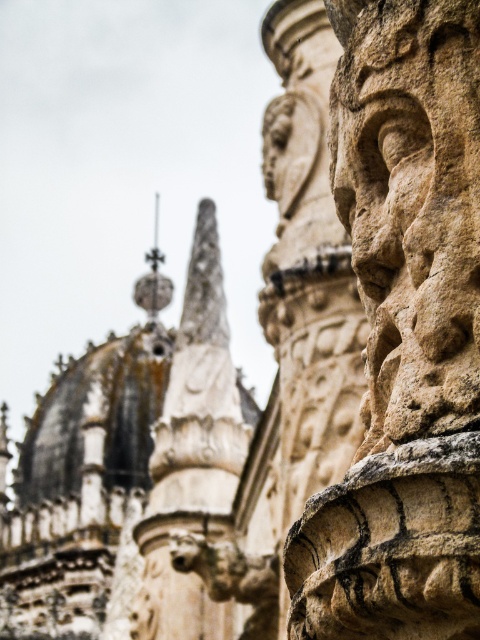
Is white stone spire at upper center smaller than polished silver spire at center?

No.

From the picture: Measure the distance between point (168, 502) and camera.

Point (168, 502) is 74.99 meters away from camera.

This screenshot has width=480, height=640. I want to click on white stone spire at upper center, so click(192, 456).

Which of these two, stone textured face at right or white stone spire at upper center, stands shorter?

Standing shorter between the two is stone textured face at right.

Does stone textured face at right appear over white stone spire at upper center?

Indeed, stone textured face at right is positioned over white stone spire at upper center.

The width and height of the screenshot is (480, 640). Find the location of `stone textured face at right`. stone textured face at right is located at coordinates (410, 205).

This screenshot has height=640, width=480. I want to click on stone textured face at right, so click(410, 205).

Consider the image. Does stone textured face at right have a lesser height compared to polished silver spire at center?

Indeed, stone textured face at right has a lesser height compared to polished silver spire at center.

Between stone textured face at right and polished silver spire at center, which one has less height?

stone textured face at right

Identify the location of stone textured face at right. (410, 205).